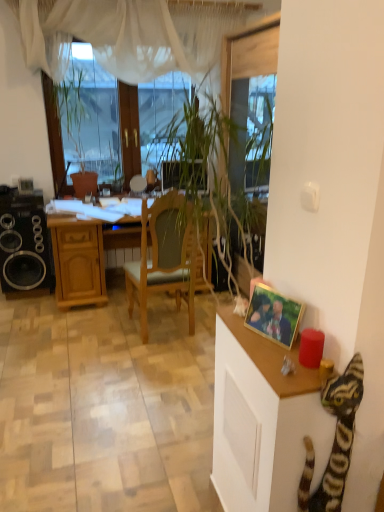
Question: Based on their positions, is gold-framed photo at right located to the left or right of wooden cabinet at right?

Choices:
 (A) right
 (B) left

Answer: (A)

Question: Is gold-framed photo at right in front of or behind wooden cabinet at right in the image?

Choices:
 (A) front
 (B) behind

Answer: (B)

Question: Based on their relative distances, which object is nearer to the wooden cabinet at right?

Choices:
 (A) wooden chair at center
 (B) wooden desk at center
 (C) striped plush cat at lower right
 (D) transparent glass window screen at upper left
 (E) gold-framed photo at right

Answer: (C)

Question: Estimate the real-world distances between objects in this image. Which object is closer to the black matte speaker at left?

Choices:
 (A) transparent glass window screen at upper left
 (B) wooden cabinet at right
 (C) gold-framed photo at right
 (D) striped plush cat at lower right
 (E) wooden desk at center

Answer: (E)